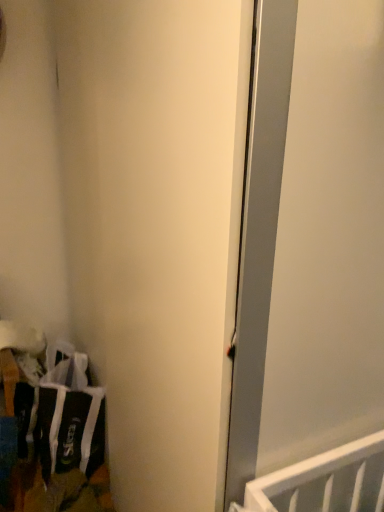
Question: Should I look upward or downward to see black fabric laundry at lower left?

Choices:
 (A) up
 (B) down

Answer: (B)

Question: Considering the relative positions of black fabric laundry at lower left and white matte door at center in the image provided, is black fabric laundry at lower left in front of white matte door at center?

Choices:
 (A) no
 (B) yes

Answer: (A)

Question: Does black fabric laundry at lower left have a lesser width compared to white matte door at center?

Choices:
 (A) yes
 (B) no

Answer: (A)

Question: Is black fabric laundry at lower left oriented towards white matte door at center?

Choices:
 (A) no
 (B) yes

Answer: (A)

Question: Is black fabric laundry at lower left wider than white matte door at center?

Choices:
 (A) yes
 (B) no

Answer: (B)

Question: Does black fabric laundry at lower left have a greater height compared to white matte door at center?

Choices:
 (A) yes
 (B) no

Answer: (B)

Question: Is black fabric laundry at lower left behind white matte door at center?

Choices:
 (A) no
 (B) yes

Answer: (B)

Question: Is white matte door at center bigger than black fabric laundry at lower left?

Choices:
 (A) yes
 (B) no

Answer: (A)

Question: Is white matte door at center not inside black fabric laundry at lower left?

Choices:
 (A) yes
 (B) no

Answer: (A)

Question: Does white matte door at center come behind black fabric laundry at lower left?

Choices:
 (A) no
 (B) yes

Answer: (A)

Question: Considering the relative positions of white matte door at center and black fabric laundry at lower left in the image provided, is white matte door at center in front of black fabric laundry at lower left?

Choices:
 (A) no
 (B) yes

Answer: (B)

Question: From a real-world perspective, is white matte door at center on black fabric laundry at lower left?

Choices:
 (A) no
 (B) yes

Answer: (B)

Question: Can you confirm if white matte door at center is thinner than black fabric laundry at lower left?

Choices:
 (A) no
 (B) yes

Answer: (A)

Question: Considering the positions of point (170, 373) and point (82, 421), is point (170, 373) closer or farther from the camera than point (82, 421)?

Choices:
 (A) farther
 (B) closer

Answer: (B)